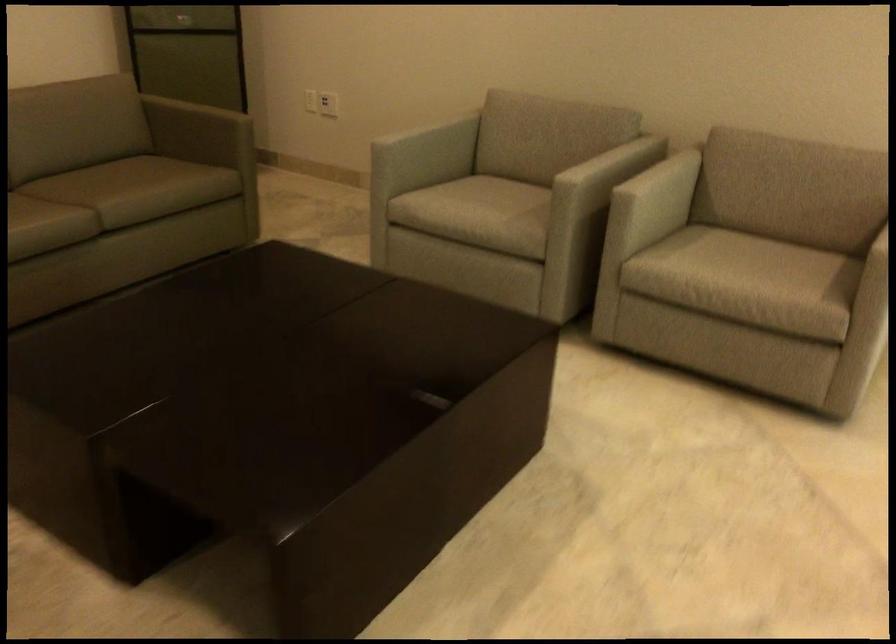
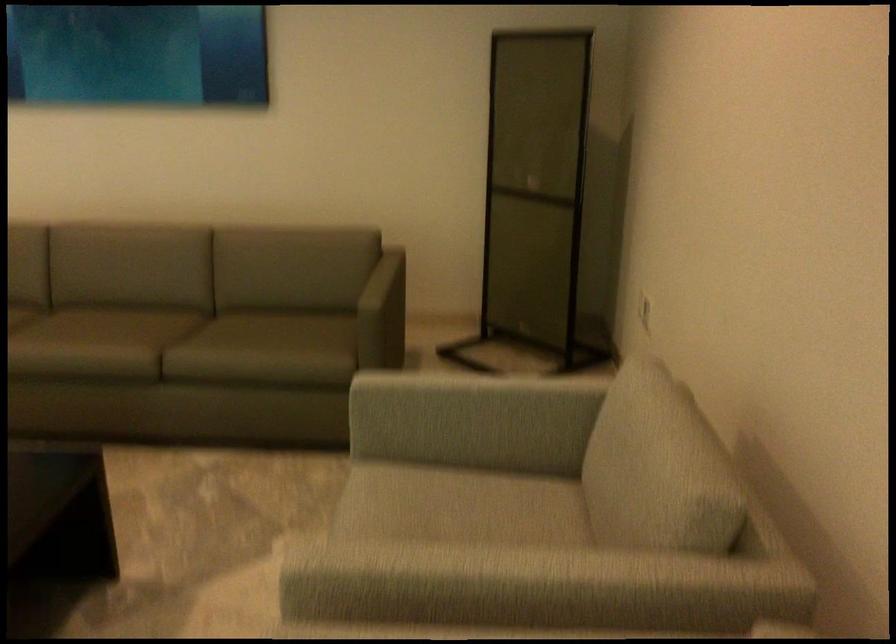
Locate, in the second image, the point that corresponds to [424,131] in the first image.

(469, 399)